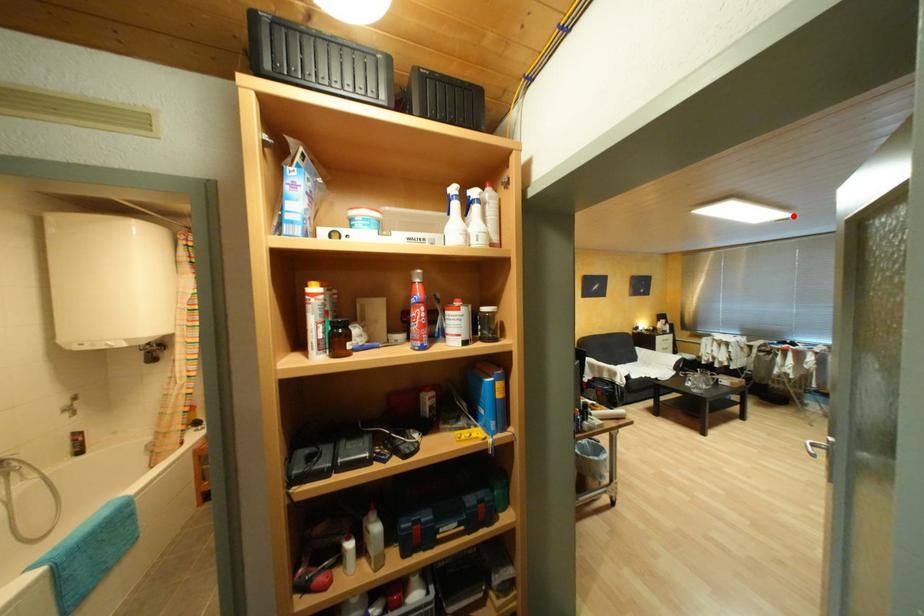
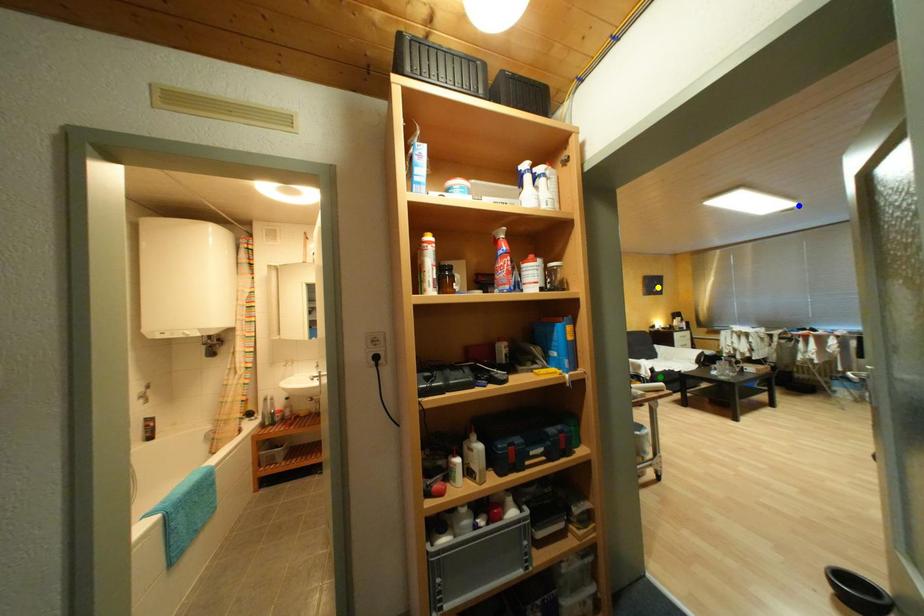
Question: I am providing you with two images of the same scene from different viewpoints. A red point is marked on the first image. You are given multiple points on the second image. In image 2, which mark is for the same physical point as the one in image 1?

Choices:
 (A) yellow point
 (B) blue point
 (C) green point

Answer: (B)